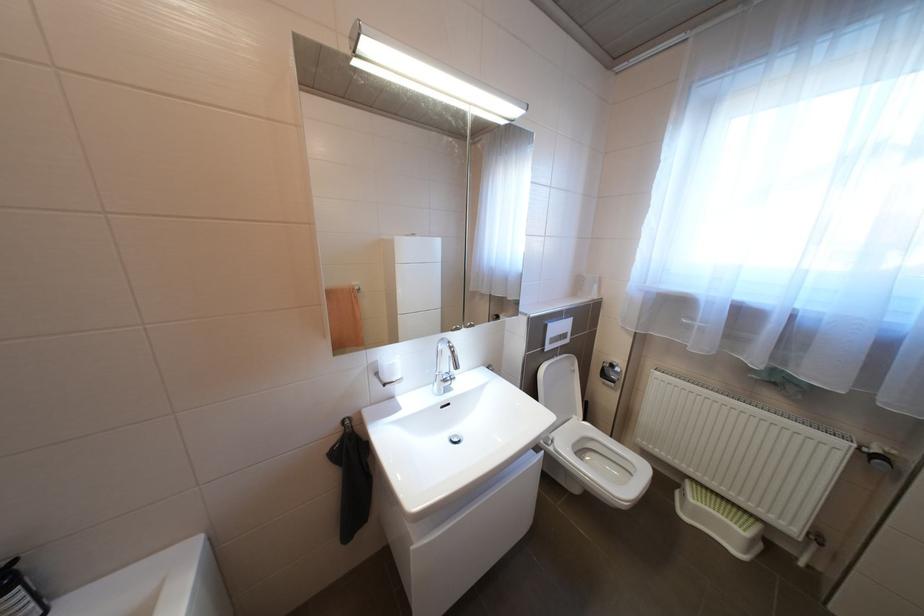
The image size is (924, 616). In order to click on radiator control knob in this screenshot , I will do `click(880, 461)`.